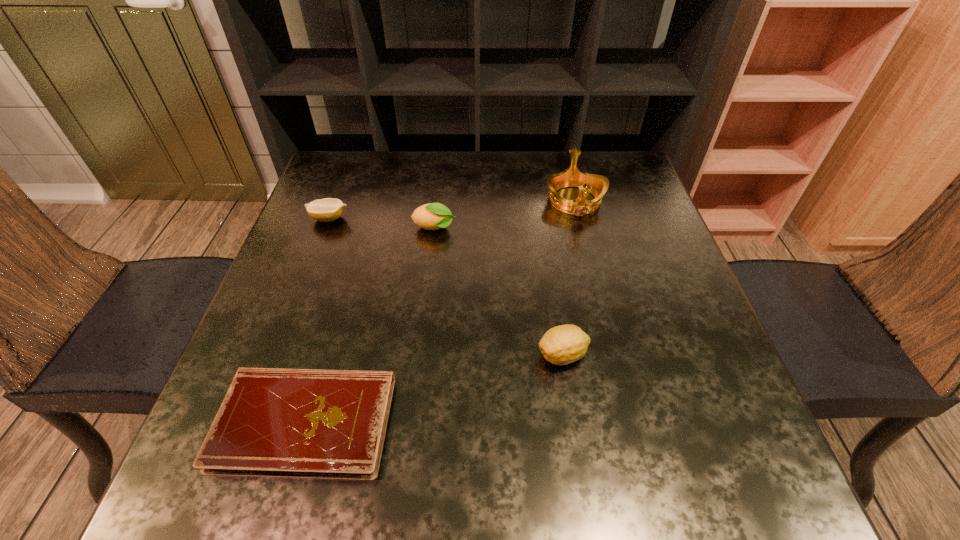
At what (x,y) coordinates should I click in order to perform the action: click on vacant position located at the stem end of the rightmost lemon. Please return your answer as a coordinate pair (x, y). Looking at the image, I should click on (331, 355).

Locate an element on the screen. The width and height of the screenshot is (960, 540). vacant space positioned at the stem end of the rightmost lemon is located at coordinates (321, 355).

Find the location of a particular element. The image size is (960, 540). free space located 0.320m at the stem end of the rightmost lemon is located at coordinates (364, 355).

Find the location of a particular element. The height and width of the screenshot is (540, 960). vacant point located 0.310m on the right of the leftmost lemon is located at coordinates (474, 218).

Identify the location of vacant space situated on the back of the notebook. (348, 274).

This screenshot has width=960, height=540. What are the coordinates of `object at the far edge` in the screenshot? It's located at (597, 185).

At what (x,y) coordinates should I click in order to perform the action: click on object located at the near edge. Please return your answer as a coordinate pair (x, y). This screenshot has height=540, width=960. Looking at the image, I should click on (293, 423).

Identify the location of lemon present at the left edge. The width and height of the screenshot is (960, 540). (328, 209).

Locate an element on the screen. The width and height of the screenshot is (960, 540). notebook that is at the left edge is located at coordinates (293, 423).

Identify the location of object that is positioned at the right edge. (597, 185).